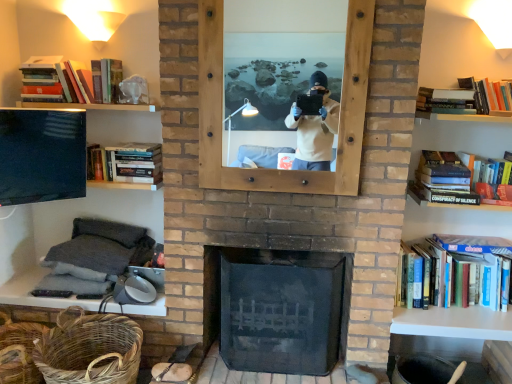
At what (x,y) coordinates should I click in order to perform the action: click on vacant space situated above white matte shelf at right, which ranks as the first mantle in right-to-left order (from a real-world perspective). Please return your answer as a coordinate pair (x, y). The height and width of the screenshot is (384, 512). Looking at the image, I should click on (453, 316).